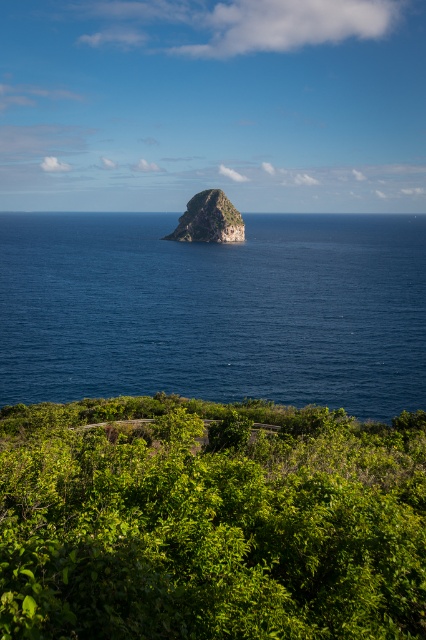
Question: Does deep blue water at center have a larger size compared to rough granite rock at center?

Choices:
 (A) no
 (B) yes

Answer: (B)

Question: Which object is positioned farthest from the deep blue water at center?

Choices:
 (A) green leafy shrubs at lower center
 (B) rough granite rock at center

Answer: (A)

Question: Which point is closer to the camera?

Choices:
 (A) green leafy shrubs at lower center
 (B) rough granite rock at center
 (C) deep blue water at center

Answer: (A)

Question: Among these objects, which one is farthest from the camera?

Choices:
 (A) green leafy shrubs at lower center
 (B) deep blue water at center
 (C) rough granite rock at center

Answer: (C)

Question: In this image, where is green leafy shrubs at lower center located relative to rough granite rock at center?

Choices:
 (A) left
 (B) right

Answer: (B)

Question: Is green leafy shrubs at lower center in front of rough granite rock at center?

Choices:
 (A) no
 (B) yes

Answer: (B)